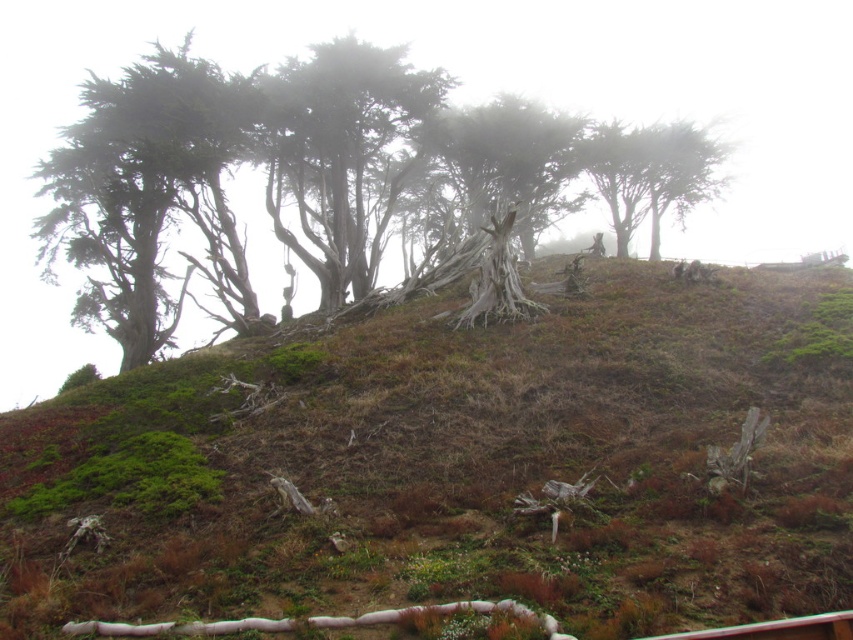
Does green mossy hillside at upper center appear on the left side of green textured tree at left?

No, green mossy hillside at upper center is not to the left of green textured tree at left.

Between green mossy hillside at upper center and green textured tree at left, which one is positioned higher?

Positioned higher is green textured tree at left.

What do you see at coordinates (457, 467) in the screenshot? I see `green mossy hillside at upper center` at bounding box center [457, 467].

I want to click on green mossy hillside at upper center, so click(457, 467).

Does smooth gray bark trees at center have a greater height compared to gray bark tree at center?

Yes.

Can you confirm if smooth gray bark trees at center is positioned to the right of gray bark tree at center?

No, smooth gray bark trees at center is not to the right of gray bark tree at center.

Between point (316, 61) and point (311, 49), which one is positioned behind?

Positioned behind is point (311, 49).

Where is `smooth gray bark trees at center`? This screenshot has width=853, height=640. smooth gray bark trees at center is located at coordinates (267, 177).

At what (x,y) coordinates should I click in order to perform the action: click on green mossy hillside at upper center. Please return your answer as a coordinate pair (x, y). This screenshot has height=640, width=853. Looking at the image, I should click on (457, 467).

Is green mossy hillside at upper center behind gray bark tree at center?

No.

Identify the location of green mossy hillside at upper center. The width and height of the screenshot is (853, 640). (457, 467).

At what (x,y) coordinates should I click in order to perform the action: click on green mossy hillside at upper center. Please return your answer as a coordinate pair (x, y). The width and height of the screenshot is (853, 640). Looking at the image, I should click on (457, 467).